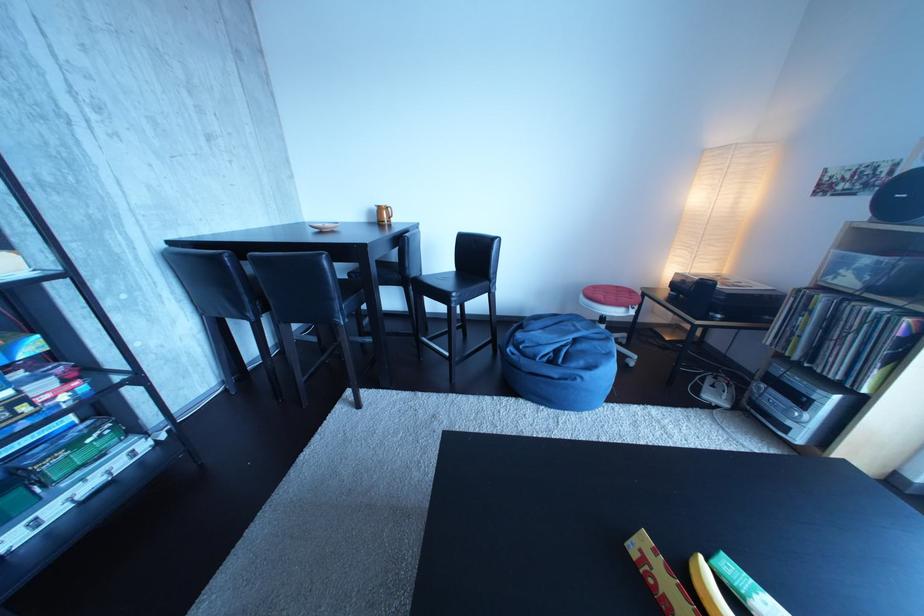
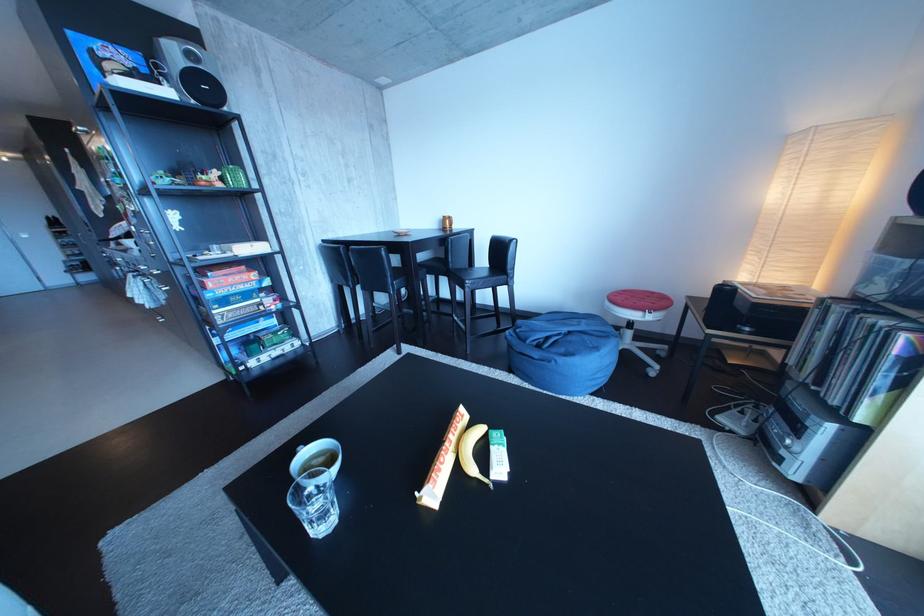
Question: I am providing you with two images of the same scene from different viewpoints. Which of the following objects are not visible in image2?

Choices:
 (A) yellow banana
 (B) board game box
 (C) blue beanbag
 (D) none of these

Answer: (D)